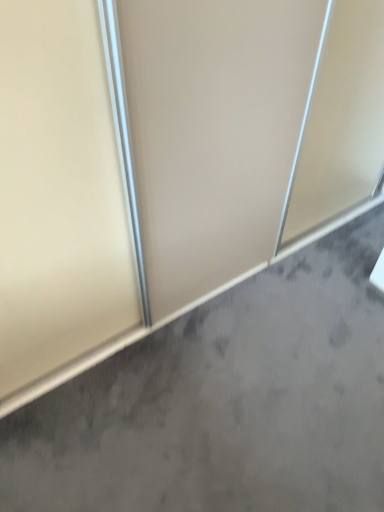
Image resolution: width=384 pixels, height=512 pixels. What do you see at coordinates (226, 401) in the screenshot?
I see `gray carpet at lower center` at bounding box center [226, 401].

This screenshot has height=512, width=384. In order to click on gray carpet at lower center in this screenshot , I will do `click(226, 401)`.

Find the location of `gray carpet at lower center`. gray carpet at lower center is located at coordinates (226, 401).